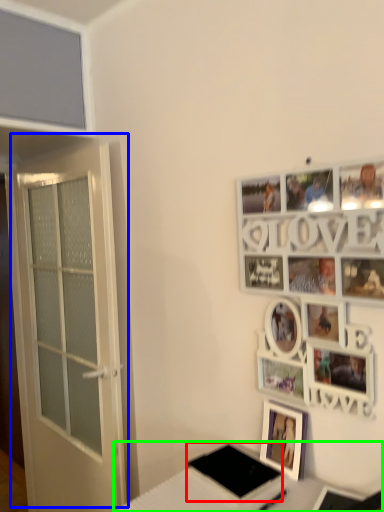
Question: Which is nearer to the pad (highlighted by a red box)? door (highlighted by a blue box) or table (highlighted by a green box).

Choices:
 (A) door
 (B) table

Answer: (B)